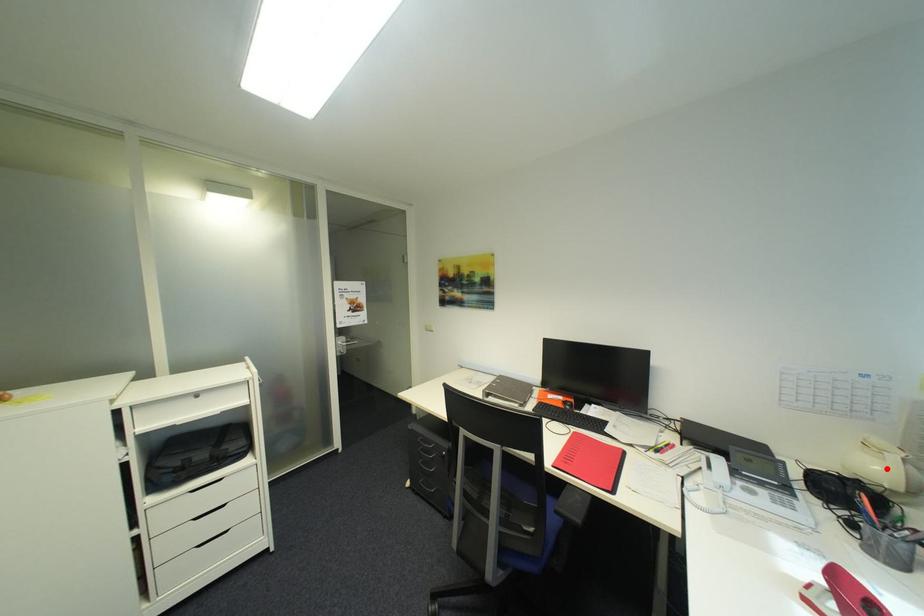
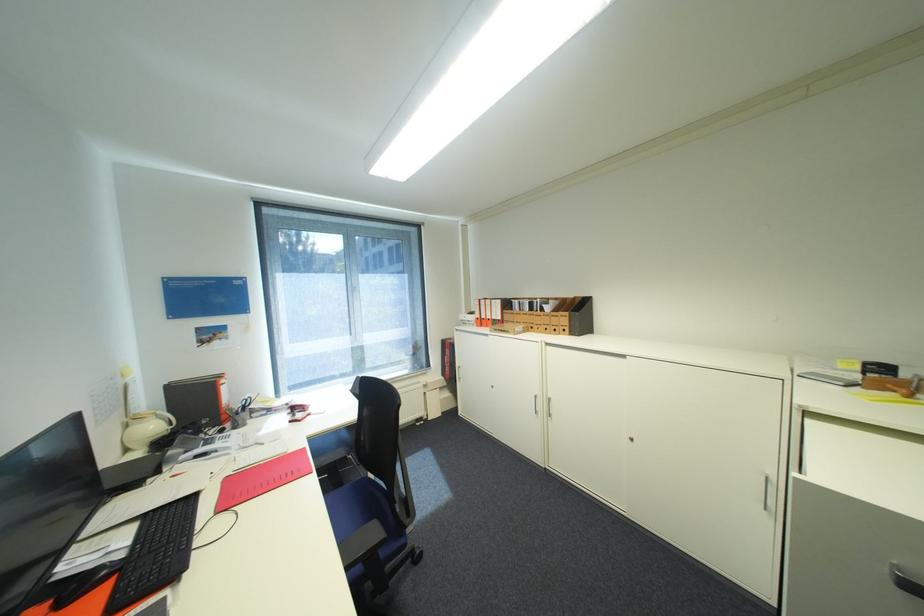
The point at the highlighted location is marked in the first image. Where is the corresponding point in the second image?

(161, 427)